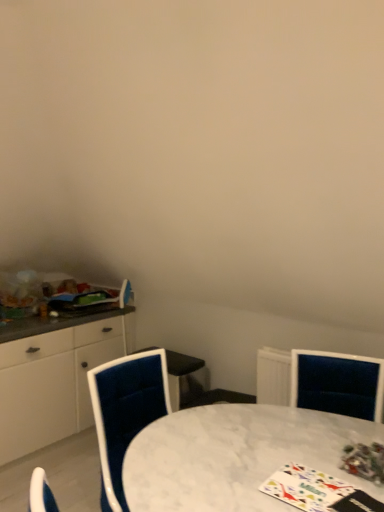
Describe the element at coordinates (235, 456) in the screenshot. I see `white marble table at center` at that location.

What is the approximate width of white marble table at center?

It is 33.95 inches.

Where is `white marble table at center`? This screenshot has height=512, width=384. white marble table at center is located at coordinates (235, 456).

Identify the location of white marble table at center. This screenshot has height=512, width=384. (235, 456).